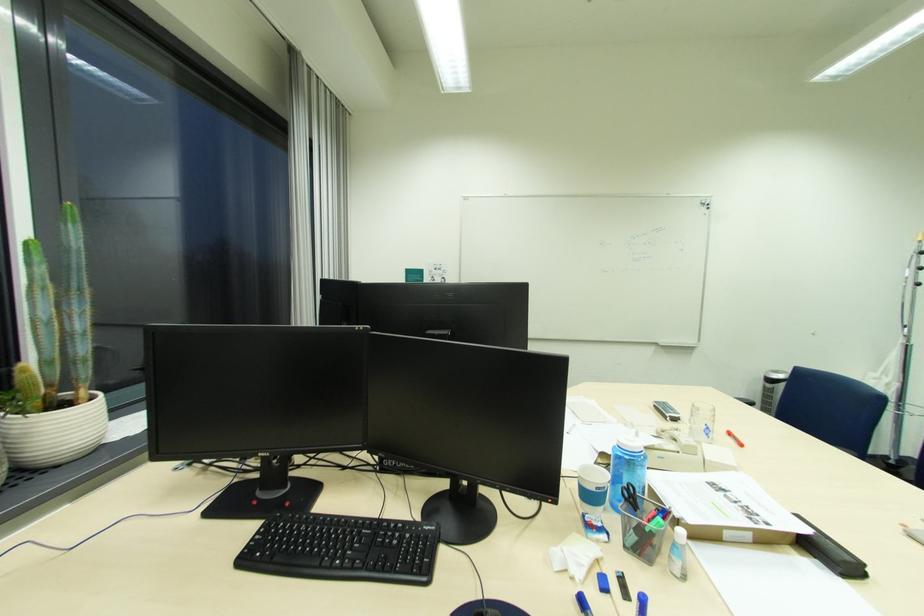
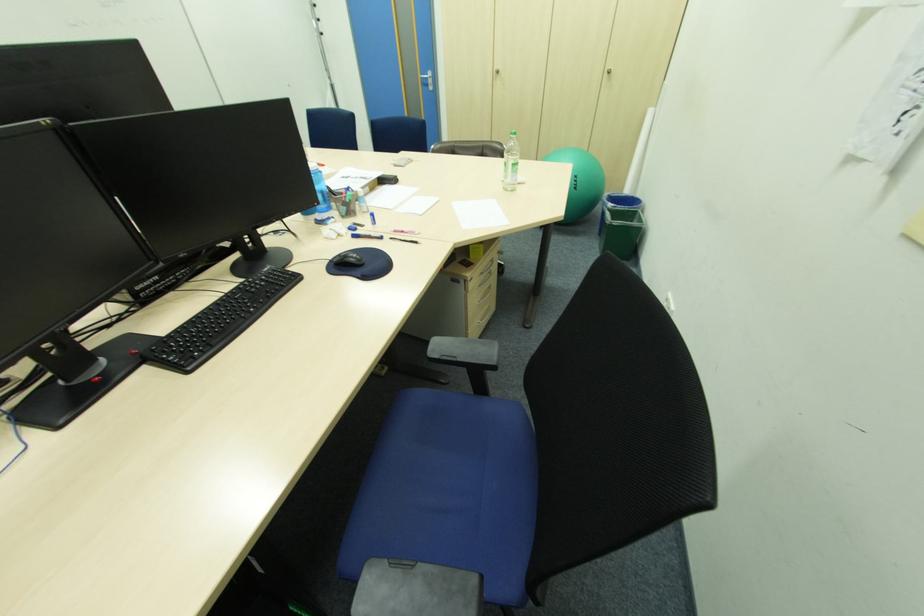
In the second image, find the point that corresponds to (639,537) in the first image.

(349, 209)